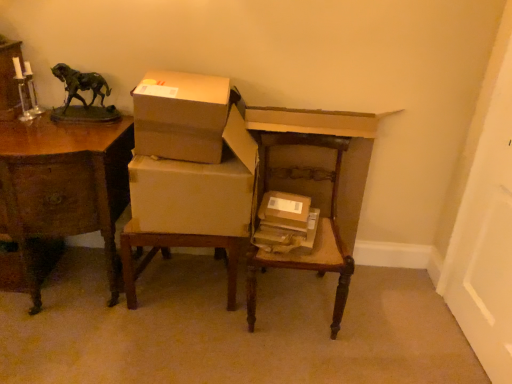
Question: Considering the positions of point (74, 210) and point (305, 218), is point (74, 210) closer or farther from the camera than point (305, 218)?

Choices:
 (A) farther
 (B) closer

Answer: (B)

Question: Do you think wooden desk at left is within brown cardboard box at center, which ranks as the 2th box in top-to-bottom order, or outside of it?

Choices:
 (A) outside
 (B) inside

Answer: (A)

Question: Which is farther from the matte cardboard boxes at center?

Choices:
 (A) wooden desk at left
 (B) brown cardboard box at center
 (C) green patina bronze horse at upper left
 (D) brown cardboard box at upper center, which appears as the 2th box when viewed from the right
 (E) wooden chair at center

Answer: (C)

Question: Estimate the real-world distances between objects in this image. Which object is closer to the matte cardboard boxes at center?

Choices:
 (A) brown cardboard box at center, which appears as the 2th box when viewed from the left
 (B) brown cardboard box at upper center, acting as the second box starting from the bottom
 (C) wooden chair at center
 (D) brown cardboard box at center
 (E) wooden desk at left

Answer: (B)